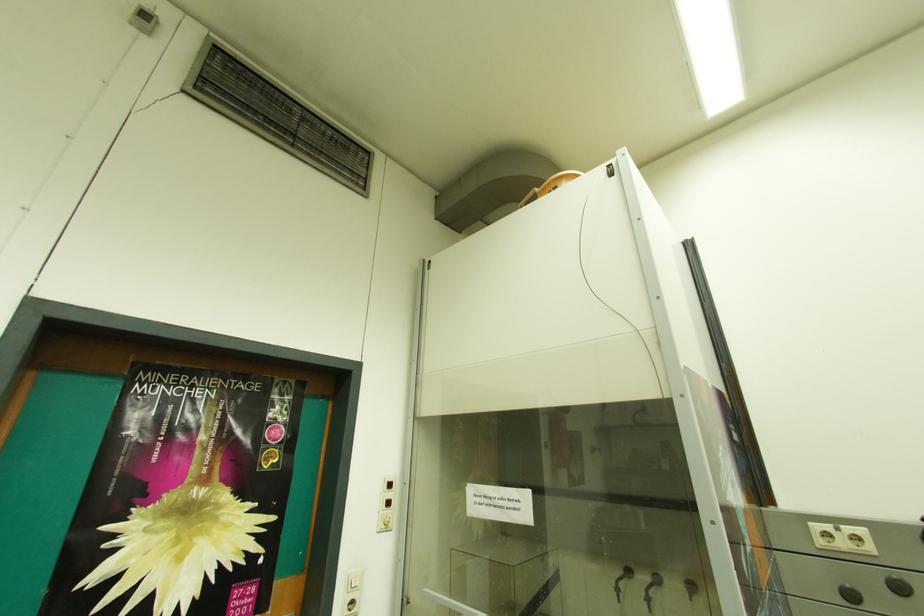
What do you see at coordinates (898, 586) in the screenshot? The height and width of the screenshot is (616, 924). I see `a black valve handle` at bounding box center [898, 586].